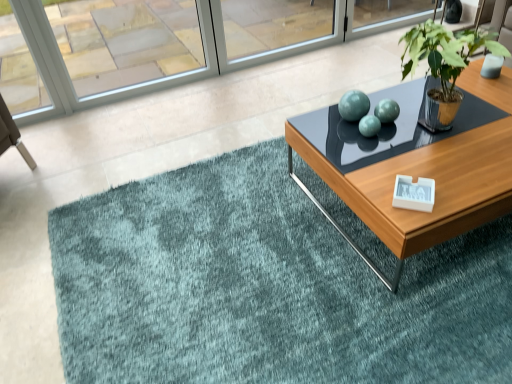
Question: Considering the relative positions of teal plush rug at center and clear glass window at upper left in the image provided, is teal plush rug at center to the left or to the right of clear glass window at upper left?

Choices:
 (A) right
 (B) left

Answer: (A)

Question: From the image's perspective, is teal plush rug at center positioned above or below clear glass window at upper left?

Choices:
 (A) below
 (B) above

Answer: (A)

Question: Estimate the real-world distances between objects in this image. Which object is closer to the green metallic plant pot at upper right?

Choices:
 (A) wooden glossy coffee table at center
 (B) clear glass window at upper left
 (C) teal plush rug at center

Answer: (A)

Question: Which object is the farthest from the clear glass window at upper left?

Choices:
 (A) wooden glossy coffee table at center
 (B) green metallic plant pot at upper right
 (C) teal plush rug at center

Answer: (B)